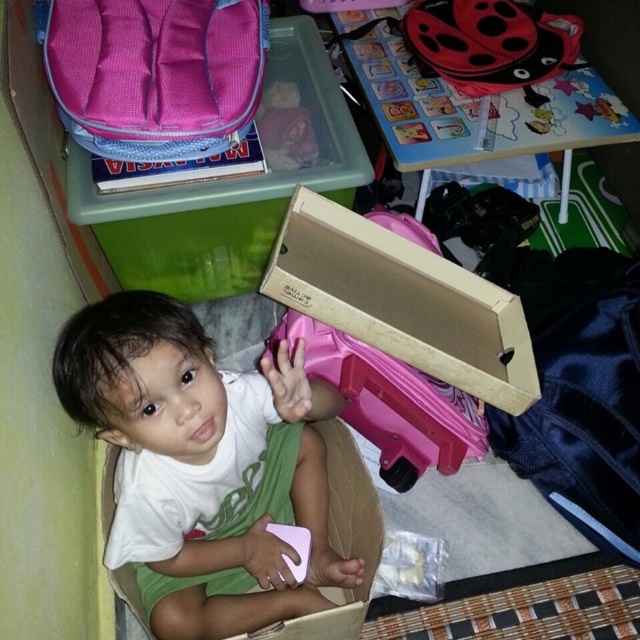
Question: Can you confirm if white matte toddler at center is positioned below pink plastic suitcase at center?

Choices:
 (A) no
 (B) yes

Answer: (B)

Question: Among these points, which one is farthest from the camera?

Choices:
 (A) (134, 321)
 (B) (355, 394)

Answer: (B)

Question: Which point is closer to the camera taking this photo?

Choices:
 (A) (353, 420)
 (B) (179, 381)

Answer: (B)

Question: Does white matte toddler at center appear on the right side of pink plastic suitcase at center?

Choices:
 (A) yes
 (B) no

Answer: (B)

Question: Which of the following is the farthest from the observer?

Choices:
 (A) (138, 321)
 (B) (365, 392)

Answer: (B)

Question: Does white matte toddler at center have a smaller size compared to pink plastic suitcase at center?

Choices:
 (A) yes
 (B) no

Answer: (B)